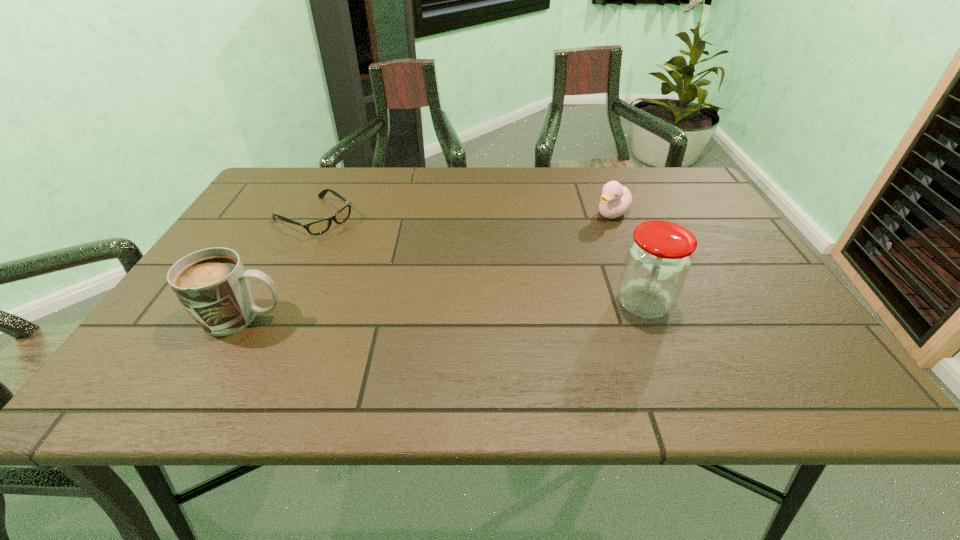
Image resolution: width=960 pixels, height=540 pixels. In order to click on free space on the desktop that is between the mug and the jar and is positioned on the front-facing side of the duckling in this screenshot , I will do `click(490, 309)`.

Identify the location of vacant space on the desktop that is between the second tallest object and the tallest object and is positioned on the front-facing side of the spectacles. (464, 310).